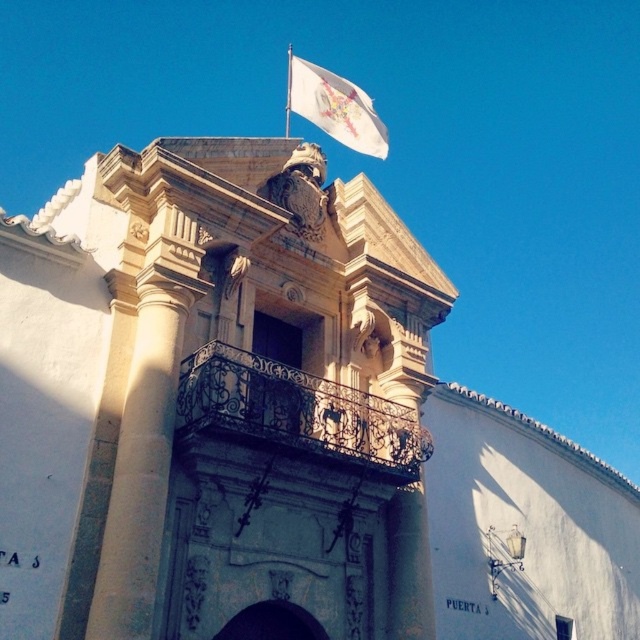
Which is below, smooth stone column at center or white fabric flag at upper center?

smooth stone column at center is below.

Can you confirm if smooth stone column at center is positioned below white fabric flag at upper center?

Yes, smooth stone column at center is below white fabric flag at upper center.

Between point (108, 630) and point (317, 112), which one is positioned in front?

Point (108, 630) is more forward.

I want to click on smooth stone column at center, so click(147, 429).

Is wrought iron balcony at center to the left of white fabric flag at upper center from the viewer's perspective?

Incorrect, wrought iron balcony at center is not on the left side of white fabric flag at upper center.

The height and width of the screenshot is (640, 640). Identify the location of wrought iron balcony at center. (298, 413).

Find the location of a particular element. The image size is (640, 640). wrought iron balcony at center is located at coordinates (298, 413).

The image size is (640, 640). What are the coordinates of `wrought iron balcony at center` in the screenshot? It's located at click(x=298, y=413).

Between smooth stone column at center and wrought iron balcony at center, which one appears on the right side from the viewer's perspective?

Positioned to the right is wrought iron balcony at center.

Who is more forward, (148, 262) or (355, 432)?

Point (148, 262)

Where is `smooth stone column at center`? smooth stone column at center is located at coordinates (147, 429).